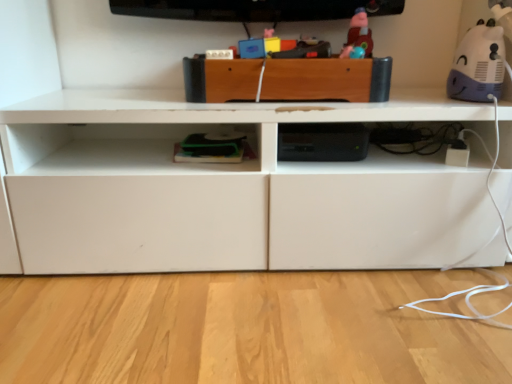
Identify the location of purple matte plush toy at upper right, the 1th toy positioned from the right. (478, 64).

I want to click on purple matte plush toy at upper right, the 1th toy positioned from the right, so click(478, 64).

Does wooden drawer at center have a greater width compared to purple matte plush toy at upper right, the 1th toy positioned from the right?

Indeed, wooden drawer at center has a greater width compared to purple matte plush toy at upper right, the 1th toy positioned from the right.

From the picture: From the image's perspective, which is below, wooden drawer at center or purple matte plush toy at upper right, the 1th toy positioned from the right?

wooden drawer at center is shown below in the image.

From the picture: Is wooden drawer at center oriented away from purple matte plush toy at upper right, the 2th toy in the left-to-right sequence?

Correct, wooden drawer at center is looking away from purple matte plush toy at upper right, the 2th toy in the left-to-right sequence.

Is wooden drawer at center at the right side of purple matte plush toy at upper right, the 1th toy positioned from the right?

No.

From a real-world perspective, who is located lower, matte plastic toy at upper center, marked as the first toy in a left-to-right arrangement, or wooden drawer at center?

From a 3D spatial view, wooden drawer at center is below.

Is matte plastic toy at upper center, marked as the first toy in a left-to-right arrangement, facing towards wooden drawer at center?

No, matte plastic toy at upper center, marked as the first toy in a left-to-right arrangement, is not oriented towards wooden drawer at center.

Visually, is matte plastic toy at upper center, which ranks as the 2th toy in right-to-left order, positioned to the left or to the right of wooden drawer at center?

matte plastic toy at upper center, which ranks as the 2th toy in right-to-left order, is to the right of wooden drawer at center.

In the scene shown: Between matte plastic toy at upper center, marked as the first toy in a left-to-right arrangement, and wooden drawer at center, which one has more height?

matte plastic toy at upper center, marked as the first toy in a left-to-right arrangement, is taller.

Which point is more distant from viewer, (469, 87) or (359, 39)?

Point (359, 39)

From a real-world perspective, which is physically below, purple matte plush toy at upper right, the 1th toy positioned from the right, or matte plastic toy at upper center, marked as the first toy in a left-to-right arrangement?

purple matte plush toy at upper right, the 1th toy positioned from the right.

Is purple matte plush toy at upper right, the 1th toy positioned from the right, not within matte plastic toy at upper center, marked as the first toy in a left-to-right arrangement?

Yes, purple matte plush toy at upper right, the 1th toy positioned from the right, is located beyond the bounds of matte plastic toy at upper center, marked as the first toy in a left-to-right arrangement.

Between purple matte plush toy at upper right, the 1th toy positioned from the right, and matte plastic toy at upper center, which ranks as the 2th toy in right-to-left order, which one has smaller size?

Smaller between the two is matte plastic toy at upper center, which ranks as the 2th toy in right-to-left order.

From the image's perspective, is wooden drawer at center above or below matte plastic toy at upper center, marked as the first toy in a left-to-right arrangement?

Clearly, from the image's perspective, wooden drawer at center is below matte plastic toy at upper center, marked as the first toy in a left-to-right arrangement.

Does wooden drawer at center have a larger size compared to matte plastic toy at upper center, marked as the first toy in a left-to-right arrangement?

→ Correct, wooden drawer at center is larger in size than matte plastic toy at upper center, marked as the first toy in a left-to-right arrangement.

Based on the photo, how different are the orientations of wooden drawer at center and matte plastic toy at upper center, which ranks as the 2th toy in right-to-left order, in degrees?

wooden drawer at center and matte plastic toy at upper center, which ranks as the 2th toy in right-to-left order, are facing 90 degrees away from each other.

Which is farther, (485, 75) or (266, 82)?

Positioned behind is point (485, 75).

Looking at this image, which object is positioned more to the left, purple matte plush toy at upper right, the 2th toy in the left-to-right sequence, or wooden drawer at center?

wooden drawer at center is more to the left.

Considering the relative sizes of matte plastic toy at upper center, which ranks as the 2th toy in right-to-left order, and purple matte plush toy at upper right, the 1th toy positioned from the right, in the image provided, is matte plastic toy at upper center, which ranks as the 2th toy in right-to-left order, thinner than purple matte plush toy at upper right, the 1th toy positioned from the right,?

Yes.

Is matte plastic toy at upper center, marked as the first toy in a left-to-right arrangement, not near purple matte plush toy at upper right, the 1th toy positioned from the right?

No, matte plastic toy at upper center, marked as the first toy in a left-to-right arrangement, is not far away from purple matte plush toy at upper right, the 1th toy positioned from the right.

Between point (369, 42) and point (452, 65), which one is positioned in front?

Point (369, 42)

The width and height of the screenshot is (512, 384). Identify the location of toy lying in front of the wooden drawer at center. (478, 64).

I want to click on the 2nd toy above the wooden drawer at center (from the image's perspective), so click(x=358, y=34).

When comparing their distances from wooden drawer at center, does matte plastic toy at upper center, marked as the first toy in a left-to-right arrangement, or purple matte plush toy at upper right, the 1th toy positioned from the right, seem further?

purple matte plush toy at upper right, the 1th toy positioned from the right.

When comparing their distances from matte plastic toy at upper center, which ranks as the 2th toy in right-to-left order, does purple matte plush toy at upper right, the 2th toy in the left-to-right sequence, or wooden drawer at center seem closer?

Based on the image, wooden drawer at center appears to be nearer to matte plastic toy at upper center, which ranks as the 2th toy in right-to-left order.

When comparing their distances from purple matte plush toy at upper right, the 1th toy positioned from the right, does matte plastic toy at upper center, marked as the first toy in a left-to-right arrangement, or wooden drawer at center seem further?

wooden drawer at center is further to purple matte plush toy at upper right, the 1th toy positioned from the right.

Based on their spatial positions, is wooden drawer at center or matte plastic toy at upper center, which ranks as the 2th toy in right-to-left order, closer to purple matte plush toy at upper right, the 2th toy in the left-to-right sequence?

matte plastic toy at upper center, which ranks as the 2th toy in right-to-left order, is closer to purple matte plush toy at upper right, the 2th toy in the left-to-right sequence.

Estimate the real-world distances between objects in this image. Which object is further from wooden drawer at center, purple matte plush toy at upper right, the 1th toy positioned from the right, or matte plastic toy at upper center, which ranks as the 2th toy in right-to-left order?

purple matte plush toy at upper right, the 1th toy positioned from the right, is positioned further to the anchor wooden drawer at center.

Considering their positions, is wooden drawer at center positioned closer to matte plastic toy at upper center, marked as the first toy in a left-to-right arrangement, than purple matte plush toy at upper right, the 1th toy positioned from the right?

wooden drawer at center is positioned closer to the anchor matte plastic toy at upper center, marked as the first toy in a left-to-right arrangement.

Locate an element on the screen. This screenshot has width=512, height=384. toy between wooden drawer at center and purple matte plush toy at upper right, the 2th toy in the left-to-right sequence, in the horizontal direction is located at coordinates (358, 34).